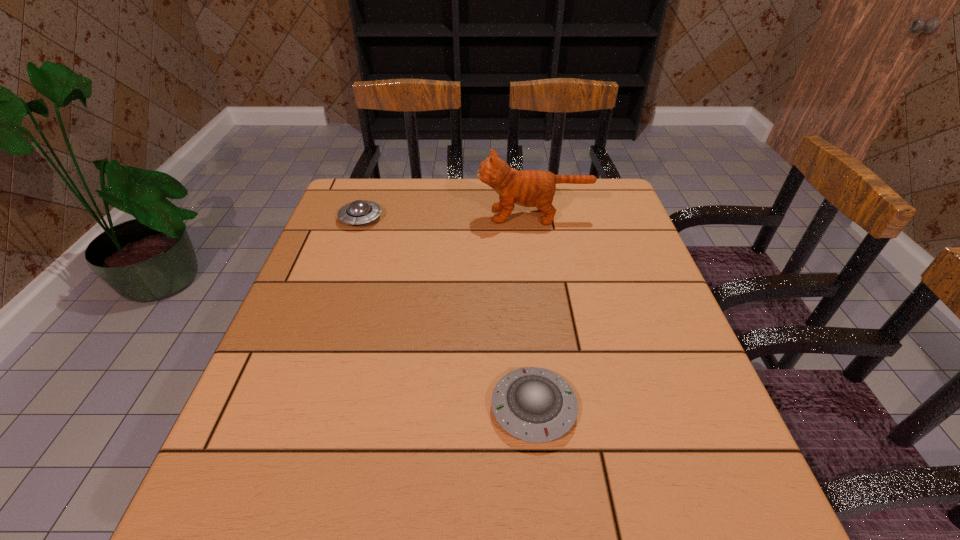
Locate an element on the screen. This screenshot has height=540, width=960. cat is located at coordinates (530, 188).

This screenshot has width=960, height=540. What are the coordinates of `the second shortest object` in the screenshot? It's located at (357, 212).

Where is `the left saucer`? the left saucer is located at coordinates (357, 212).

Where is `the nearer saucer`? This screenshot has width=960, height=540. the nearer saucer is located at coordinates (533, 404).

The width and height of the screenshot is (960, 540). Find the location of `the nearest object`. the nearest object is located at coordinates (533, 404).

Where is `vacant space located on the face of the cat`? vacant space located on the face of the cat is located at coordinates (338, 215).

Image resolution: width=960 pixels, height=540 pixels. What are the coordinates of `free space located on the face of the cat` in the screenshot? It's located at (453, 215).

Where is `free region located on the face of the cat`? This screenshot has width=960, height=540. free region located on the face of the cat is located at coordinates (376, 215).

I want to click on vacant area situated on the right of the leftmost object, so click(418, 218).

The height and width of the screenshot is (540, 960). I want to click on vacant space located 0.110m on the right of the nearer saucer, so click(636, 408).